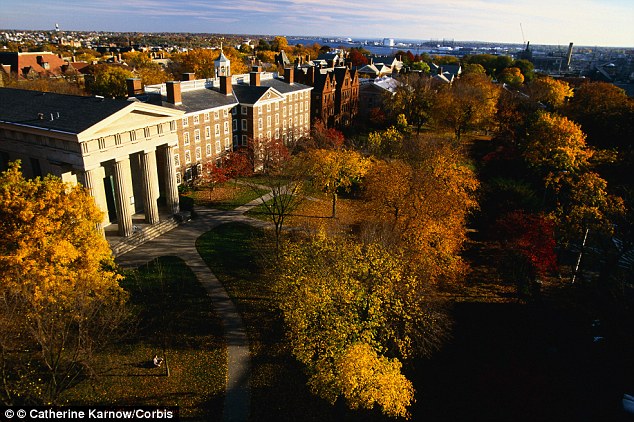
Identify the location of chimney. (170, 97), (228, 86), (252, 76), (286, 73).